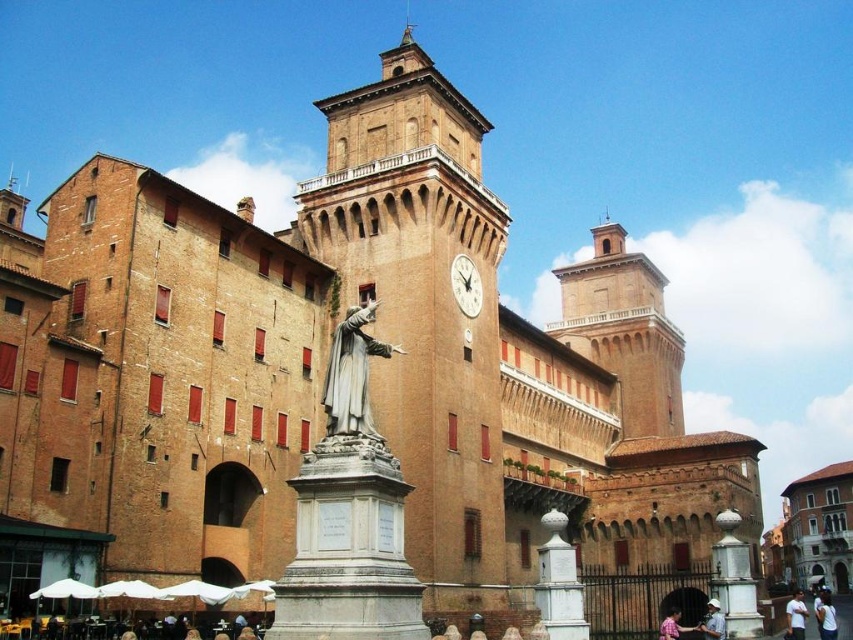
Does brown brick clock tower at center appear on the right side of polished bronze statue at center?

Yes, brown brick clock tower at center is to the right of polished bronze statue at center.

Who is more forward, (485, 576) or (381, 356)?

Point (381, 356) is more forward.

Find the location of a particular element. The image size is (853, 640). brown brick clock tower at center is located at coordinates (421, 307).

Which of these two, brown brick clock tower at center or white cotton shirt at center, stands taller?

brown brick clock tower at center

What do you see at coordinates (421, 307) in the screenshot? I see `brown brick clock tower at center` at bounding box center [421, 307].

Where is `brown brick clock tower at center`? brown brick clock tower at center is located at coordinates (421, 307).

Can you confirm if white cotton shirt at center is smaller than pink fabric shirt at lower center?

Actually, white cotton shirt at center might be larger than pink fabric shirt at lower center.

Who is positioned more to the right, white cotton shirt at center or pink fabric shirt at lower center?

From the viewer's perspective, white cotton shirt at center appears more on the right side.

Identify the location of white cotton shirt at center. This screenshot has height=640, width=853. (795, 616).